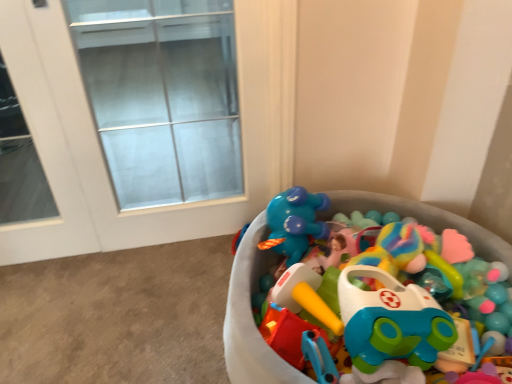
The height and width of the screenshot is (384, 512). What do you see at coordinates (251, 317) in the screenshot?
I see `plastic toy car at center` at bounding box center [251, 317].

Image resolution: width=512 pixels, height=384 pixels. Find the location of `plastic toy car at center`. plastic toy car at center is located at coordinates (251, 317).

Find the location of a particular element. transparent glass door at upper left is located at coordinates (162, 96).

Measure the distance between point (108, 152) and camera.

They are 2.41 meters apart.

The height and width of the screenshot is (384, 512). Describe the element at coordinates (162, 96) in the screenshot. I see `transparent glass door at upper left` at that location.

This screenshot has height=384, width=512. I want to click on plastic toy car at center, so click(251, 317).

Can you confirm if plastic toy car at center is positioned to the left of transparent glass door at upper left?

In fact, plastic toy car at center is to the right of transparent glass door at upper left.

Is the depth of plastic toy car at center greater than that of transparent glass door at upper left?

No, it is not.

Is point (473, 239) positioned behind point (179, 117)?

That is False.

From the image's perspective, which one is positioned higher, plastic toy car at center or transparent glass door at upper left?

transparent glass door at upper left, from the image's perspective.

From a real-world perspective, relative to transparent glass door at upper left, is plastic toy car at center vertically above or below?

Clearly, from a real-world perspective, plastic toy car at center is below transparent glass door at upper left.

Does plastic toy car at center have a greater width compared to transparent glass door at upper left?

Yes, plastic toy car at center is wider than transparent glass door at upper left.

Between plastic toy car at center and transparent glass door at upper left, which one has more height?

With more height is transparent glass door at upper left.

Does plastic toy car at center have a larger size compared to transparent glass door at upper left?

Correct, plastic toy car at center is larger in size than transparent glass door at upper left.

Is plastic toy car at center outside of transparent glass door at upper left?

Yes, plastic toy car at center is outside of transparent glass door at upper left.

Can you see plastic toy car at center touching transparent glass door at upper left?

plastic toy car at center is not next to transparent glass door at upper left, and they're not touching.

Is plastic toy car at center looking in the opposite direction of transparent glass door at upper left?

No.

How many degrees apart are the facing directions of plastic toy car at center and transparent glass door at upper left?

There is a 90.2-degree angle between the facing directions of plastic toy car at center and transparent glass door at upper left.

How much distance is there between plastic toy car at center and transparent glass door at upper left?

→ plastic toy car at center is 1.95 meters away from transparent glass door at upper left.

Identify the location of toy on the right of the transparent glass door at upper left. The height and width of the screenshot is (384, 512). (251, 317).

Considering the relative positions of transparent glass door at upper left and plastic toy car at center in the image provided, is transparent glass door at upper left to the left or to the right of plastic toy car at center?

In the image, transparent glass door at upper left appears on the left side of plastic toy car at center.

Based on the photo, considering the positions of objects transparent glass door at upper left and plastic toy car at center in the image provided, who is behind, transparent glass door at upper left or plastic toy car at center?

transparent glass door at upper left is further from the camera.

Is point (172, 65) behind point (295, 376)?

Yes.

Based on the photo, from the image's perspective, which is below, transparent glass door at upper left or plastic toy car at center?

plastic toy car at center, from the image's perspective.

From a real-world perspective, is transparent glass door at upper left above or below plastic toy car at center?

transparent glass door at upper left is situated higher than plastic toy car at center in the real world.

In terms of width, does transparent glass door at upper left look wider or thinner when compared to plastic toy car at center?

In the image, transparent glass door at upper left appears to be more narrow than plastic toy car at center.

Considering the sizes of objects transparent glass door at upper left and plastic toy car at center in the image provided, who is taller, transparent glass door at upper left or plastic toy car at center?

With more height is transparent glass door at upper left.

Consider the image. Based on their sizes in the image, would you say transparent glass door at upper left is bigger or smaller than plastic toy car at center?

In the image, transparent glass door at upper left appears to be smaller than plastic toy car at center.

Do you think transparent glass door at upper left is within plastic toy car at center, or outside of it?

transparent glass door at upper left exists outside the volume of plastic toy car at center.

Is there a large distance between transparent glass door at upper left and plastic toy car at center?

Yes, transparent glass door at upper left and plastic toy car at center are located far from each other.

Does transparent glass door at upper left turn towards plastic toy car at center?

No, transparent glass door at upper left is not facing towards plastic toy car at center.

In the scene shown: Can you tell me how much transparent glass door at upper left and plastic toy car at center differ in facing direction?

90.2 degrees.

How much distance is there between transparent glass door at upper left and plastic toy car at center?

transparent glass door at upper left and plastic toy car at center are 1.95 meters apart.

This screenshot has width=512, height=384. In order to click on toy to the right of transparent glass door at upper left in this screenshot , I will do `click(251, 317)`.

This screenshot has height=384, width=512. I want to click on toy below the transparent glass door at upper left (from the image's perspective), so click(251, 317).

Locate an element on the screen. The image size is (512, 384). glass door above the plastic toy car at center (from a real-world perspective) is located at coordinates (162, 96).